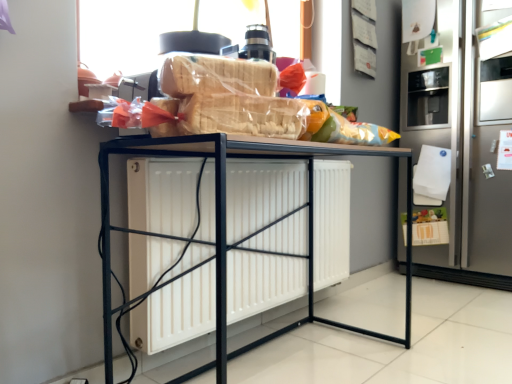
Question: Is satin silver refrigerator at right outside black metal table at center?

Choices:
 (A) yes
 (B) no

Answer: (A)

Question: Is satin silver refrigerator at right shorter than black metal table at center?

Choices:
 (A) yes
 (B) no

Answer: (B)

Question: From the image's perspective, is satin silver refrigerator at right above black metal table at center?

Choices:
 (A) no
 (B) yes

Answer: (B)

Question: Can you confirm if satin silver refrigerator at right is wider than black metal table at center?

Choices:
 (A) yes
 (B) no

Answer: (A)

Question: Does satin silver refrigerator at right have a smaller size compared to black metal table at center?

Choices:
 (A) yes
 (B) no

Answer: (B)

Question: From a real-world perspective, does satin silver refrigerator at right sit lower than black metal table at center?

Choices:
 (A) no
 (B) yes

Answer: (A)

Question: Considering the relative sizes of black metal table at center and satin silver refrigerator at right in the image provided, is black metal table at center wider than satin silver refrigerator at right?

Choices:
 (A) no
 (B) yes

Answer: (A)

Question: Is black metal table at center looking in the opposite direction of satin silver refrigerator at right?

Choices:
 (A) no
 (B) yes

Answer: (A)

Question: Considering the relative sizes of black metal table at center and satin silver refrigerator at right in the image provided, is black metal table at center bigger than satin silver refrigerator at right?

Choices:
 (A) yes
 (B) no

Answer: (B)

Question: Considering the relative sizes of black metal table at center and satin silver refrigerator at right in the image provided, is black metal table at center shorter than satin silver refrigerator at right?

Choices:
 (A) yes
 (B) no

Answer: (A)

Question: From the image's perspective, does black metal table at center appear higher than satin silver refrigerator at right?

Choices:
 (A) no
 (B) yes

Answer: (A)

Question: Are black metal table at center and satin silver refrigerator at right beside each other?

Choices:
 (A) yes
 (B) no

Answer: (B)

Question: From a real-world perspective, is satin silver refrigerator at right above or below black metal table at center?

Choices:
 (A) below
 (B) above

Answer: (B)